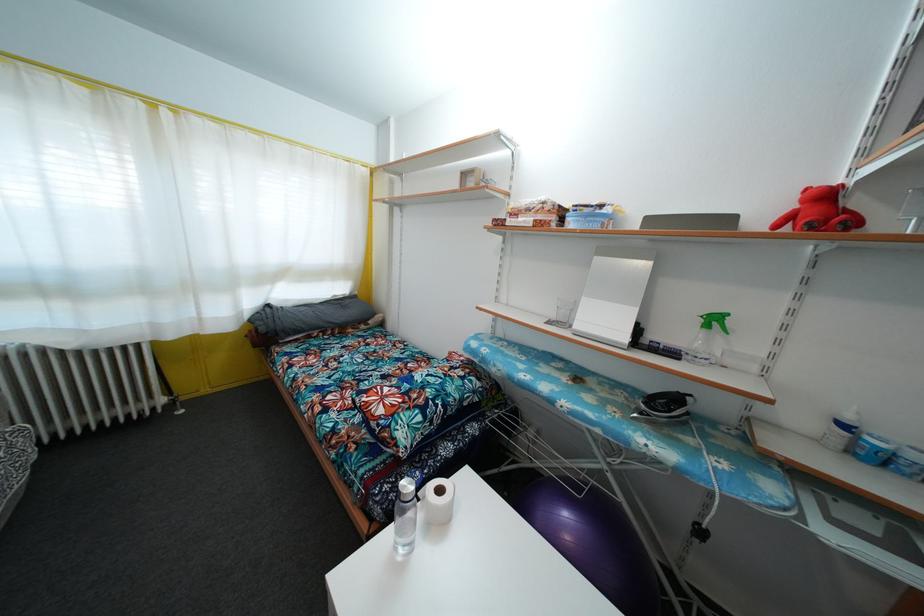
This screenshot has width=924, height=616. I want to click on green spray trigger, so click(714, 321).